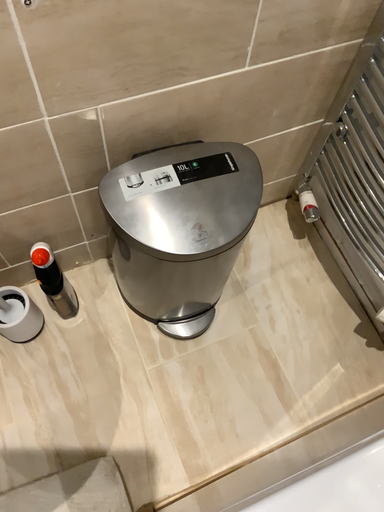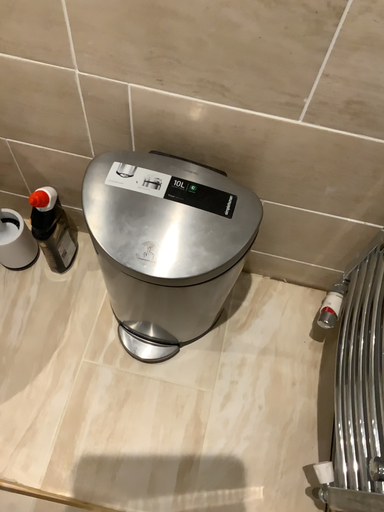
Question: Which way did the camera rotate in the video?

Choices:
 (A) rotated right
 (B) rotated left

Answer: (B)